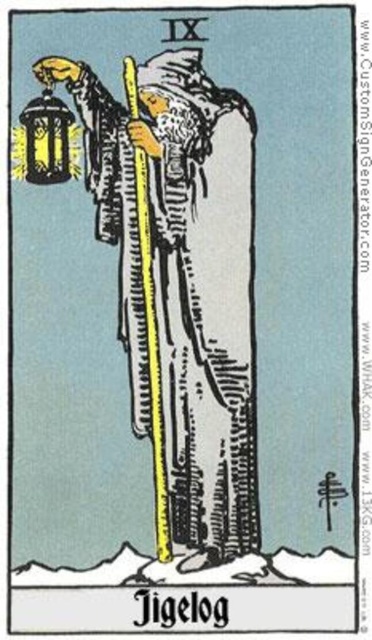
Question: Among these points, which one is nearest to the camera?

Choices:
 (A) (63, 106)
 (B) (254, 493)

Answer: (A)

Question: Which point is farther from the camera taking this photo?

Choices:
 (A) (146, 122)
 (B) (142, 282)

Answer: (B)

Question: Which of these objects is positioned closest to the white textured robe at center?

Choices:
 (A) metallic lantern at left
 (B) yellow wood pole at center

Answer: (B)

Question: Does white textured robe at center lie in front of yellow wood pole at center?

Choices:
 (A) no
 (B) yes

Answer: (B)

Question: Is yellow wood pole at center thinner than metallic lantern at left?

Choices:
 (A) yes
 (B) no

Answer: (A)

Question: Does yellow wood pole at center have a larger size compared to metallic lantern at left?

Choices:
 (A) yes
 (B) no

Answer: (A)